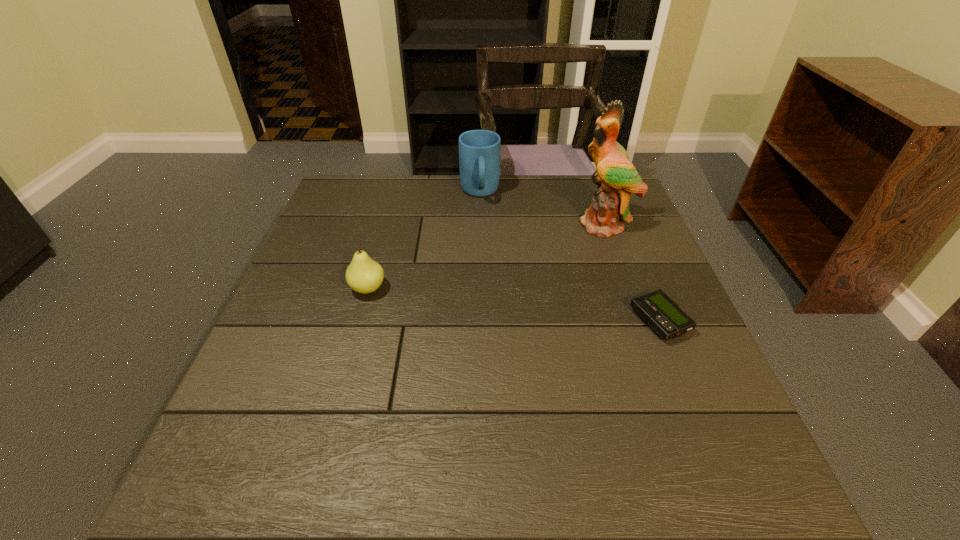
You are a GUI agent. You are given a task and a screenshot of the screen. Output one action in this format:
    pyautogui.click(x=<x>, y=<y>)
    Task: Click on the vacant space in between the second shortest object and the shortest object
    This screenshot has width=960, height=540.
    Given the screenshot: What is the action you would take?
    pyautogui.click(x=514, y=305)

The image size is (960, 540). I want to click on free spot between the second shortest object and the parrot, so click(487, 256).

Image resolution: width=960 pixels, height=540 pixels. In order to click on vacant area between the mug and the parrot in this screenshot , I will do `click(542, 208)`.

What are the coordinates of `unoccupied area between the third tallest object and the third nearest object` in the screenshot? It's located at (487, 256).

At what (x,y) coordinates should I click in order to perform the action: click on blank region between the shortest object and the second object from left to right. Please return your answer as a coordinate pair (x, y). Image resolution: width=960 pixels, height=540 pixels. Looking at the image, I should click on (569, 257).

Locate an element on the screen. vacant area between the tallest object and the leftmost object is located at coordinates tap(487, 256).

Identify which object is the second nearest to the third object from right to left. Please provide its 2D coordinates. Your answer should be formatted as a tuple, i.e. [(x, y)], where the tuple contains the x and y coordinates of a point satisfying the conditions above.

[(364, 275)]

Locate an element on the screen. Image resolution: width=960 pixels, height=540 pixels. object that is the closest one to the tallest object is located at coordinates (479, 150).

The width and height of the screenshot is (960, 540). I want to click on vacant space that satisfies the following two spatial constraints: 1. on the front side of the tallest object; 2. on the right side of the beeper, so click(641, 321).